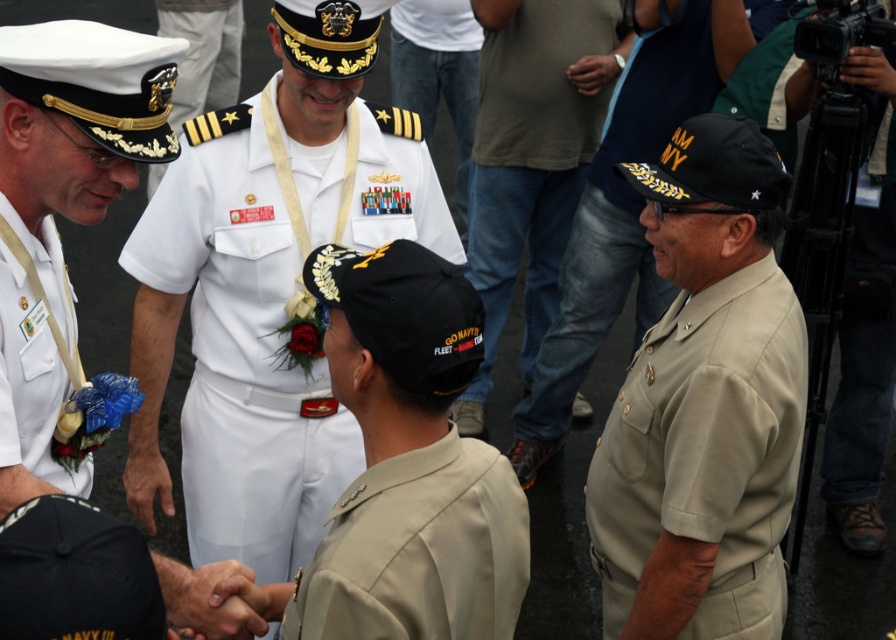
Which is above, white cotton dress uniform at center or tan uniform at center?

tan uniform at center is above.

Which is more to the right, white cotton dress uniform at center or tan uniform at center?

Positioned to the right is tan uniform at center.

The height and width of the screenshot is (640, 896). What are the coordinates of `white cotton dress uniform at center` in the screenshot? It's located at (271, 314).

Measure the distance between tan uniform at center and white matte uniform at left.

tan uniform at center is 3.09 meters from white matte uniform at left.

Does tan uniform at center appear on the left side of white matte uniform at left?

No, tan uniform at center is not to the left of white matte uniform at left.

Is point (719, 60) farther from camera compared to point (42, 438)?

Yes.

Where is `tan uniform at center`? tan uniform at center is located at coordinates (625, 205).

Which is more to the right, white cotton dress uniform at center or black fabric cap at lower right?

black fabric cap at lower right

Which of these two, white cotton dress uniform at center or black fabric cap at lower right, stands shorter?

Standing shorter between the two is white cotton dress uniform at center.

Is point (277, 362) farther from viewer compared to point (504, 186)?

No, it is not.

Locate an element on the screen. This screenshot has height=640, width=896. white cotton dress uniform at center is located at coordinates (271, 314).